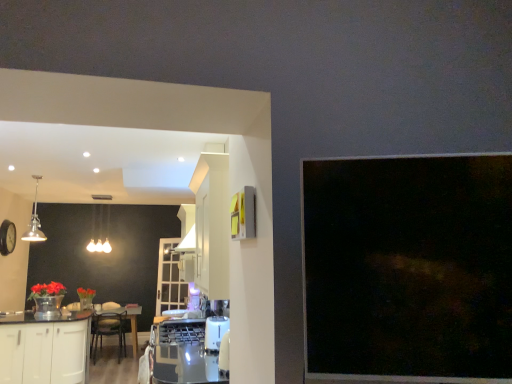
I want to click on wooden round table at center, so click(131, 322).

The height and width of the screenshot is (384, 512). What do you see at coordinates (170, 278) in the screenshot?
I see `clear glass door at center` at bounding box center [170, 278].

This screenshot has width=512, height=384. Find the location of `white glossy cabinetry at lower left`. white glossy cabinetry at lower left is located at coordinates (42, 353).

Can we say clear glass door at center lies outside matte glass chandelier at upper center?

Absolutely, clear glass door at center is external to matte glass chandelier at upper center.

Are clear glass door at center and matte glass chandelier at upper center far apart?

Yes.

Is clear glass door at center at the left side of matte glass chandelier at upper center?

In fact, clear glass door at center is to the right of matte glass chandelier at upper center.

What's the angular difference between clear glass door at center and matte glass chandelier at upper center's facing directions?

The angle between the facing direction of clear glass door at center and the facing direction of matte glass chandelier at upper center is 37.1 degrees.

Between matte glass chandelier at upper center and wooden round table at center, which one has larger size?

With larger size is wooden round table at center.

Measure the distance from matte glass chandelier at upper center to wooden round table at center.

The distance of matte glass chandelier at upper center from wooden round table at center is 1.54 meters.

Is wooden round table at center at the back of matte glass chandelier at upper center?

matte glass chandelier at upper center is not turned away from wooden round table at center.

Which is more to the right, matte glass chandelier at upper center or wooden round table at center?

wooden round table at center.

Is clear glass door at center not close to white glossy cabinetry at lower left?

clear glass door at center is positioned a significant distance from white glossy cabinetry at lower left.

Which is more to the left, clear glass door at center or white glossy cabinetry at lower left?

Positioned to the left is white glossy cabinetry at lower left.

Which of these two, clear glass door at center or white glossy cabinetry at lower left, is smaller?

clear glass door at center.

From the picture: From a real-world perspective, is clear glass door at center under white glossy cabinetry at lower left?

Incorrect, from a real-world perspective, clear glass door at center is higher than white glossy cabinetry at lower left.

Locate an element on the screen. This screenshot has height=384, width=512. glass door behind the matte glass chandelier at upper center is located at coordinates (170, 278).

Would you consider matte glass chandelier at upper center to be distant from clear glass door at center?

Indeed, matte glass chandelier at upper center is not near clear glass door at center.

Could you tell me if matte glass chandelier at upper center is turned towards clear glass door at center?

No, matte glass chandelier at upper center is not aimed at clear glass door at center.

Does matte glass chandelier at upper center appear on the right side of clear glass door at center?

Incorrect, matte glass chandelier at upper center is not on the right side of clear glass door at center.

Locate an element on the screen. The image size is (512, 384). glass door located above the wooden round table at center (from a real-world perspective) is located at coordinates (170, 278).

From a real-world perspective, which object rests below the other?

wooden round table at center, from a real-world perspective.

Is wooden round table at center oriented away from clear glass door at center?

wooden round table at center is not turned away from clear glass door at center.

From a real-world perspective, is clear glass door at center on top of wooden round table at center?

Correct, in the physical world, clear glass door at center is higher than wooden round table at center.

At what (x,y) coordinates should I click in order to perform the action: click on glass door lying behind the wooden round table at center. Please return your answer as a coordinate pair (x, y). The height and width of the screenshot is (384, 512). Looking at the image, I should click on (170, 278).

From the image's perspective, which is below, clear glass door at center or wooden round table at center?

wooden round table at center.

Considering the points (160, 295) and (127, 308), which point is in front, point (160, 295) or point (127, 308)?

Point (160, 295)

Find the location of a particular element. cabinetry located above the wooden round table at center (from a real-world perspective) is located at coordinates (42, 353).

From the image's perspective, between wooden round table at center and white glossy cabinetry at lower left, who is located below?

wooden round table at center.

From a real-world perspective, who is located lower, wooden round table at center or white glossy cabinetry at lower left?

wooden round table at center.

Is wooden round table at center turned away from white glossy cabinetry at lower left?

No, wooden round table at center is not facing the opposite direction of white glossy cabinetry at lower left.

Find the location of a particular element. This screenshot has width=512, height=384. glass door behind the matte glass chandelier at upper center is located at coordinates (170, 278).

Find the location of a particular element. Image resolution: width=512 pixels, height=384 pixels. lighting above the wooden round table at center (from the image's perspective) is located at coordinates tap(99, 233).

Based on their spatial positions, is matte glass chandelier at upper center or clear glass door at center further from wooden round table at center?

The object further to wooden round table at center is matte glass chandelier at upper center.

Looking at the image, which one is located further to wooden round table at center, clear glass door at center or matte glass chandelier at upper center?

The object further to wooden round table at center is matte glass chandelier at upper center.

Looking at the image, which one is located closer to wooden round table at center, clear glass door at center or white glossy cabinetry at lower left?

clear glass door at center is closer to wooden round table at center.

From the image, which object appears to be farther from clear glass door at center, wooden round table at center or matte glass chandelier at upper center?

The object further to clear glass door at center is matte glass chandelier at upper center.

Looking at the image, which one is located closer to white glossy cabinetry at lower left, clear glass door at center or wooden round table at center?

Among the two, wooden round table at center is located nearer to white glossy cabinetry at lower left.

Estimate the real-world distances between objects in this image. Which object is closer to white glossy cabinetry at lower left, wooden round table at center or matte glass chandelier at upper center?

Based on the image, wooden round table at center appears to be nearer to white glossy cabinetry at lower left.

When comparing their distances from matte glass chandelier at upper center, does white glossy cabinetry at lower left or wooden round table at center seem closer?

The object closer to matte glass chandelier at upper center is wooden round table at center.

From the image, which object appears to be farther from matte glass chandelier at upper center, white glossy cabinetry at lower left or clear glass door at center?

The object further to matte glass chandelier at upper center is white glossy cabinetry at lower left.

This screenshot has width=512, height=384. What are the coordinates of `glass door that lies between matte glass chandelier at upper center and wooden round table at center from top to bottom` in the screenshot? It's located at (170, 278).

The width and height of the screenshot is (512, 384). What are the coordinates of `round table positioned between white glossy cabinetry at lower left and clear glass door at center from near to far` in the screenshot? It's located at (131, 322).

What are the coordinates of `lighting positioned between white glossy cabinetry at lower left and clear glass door at center from near to far` in the screenshot? It's located at (99, 233).

Locate an element on the screen. The height and width of the screenshot is (384, 512). round table between white glossy cabinetry at lower left and matte glass chandelier at upper center from front to back is located at coordinates (131, 322).